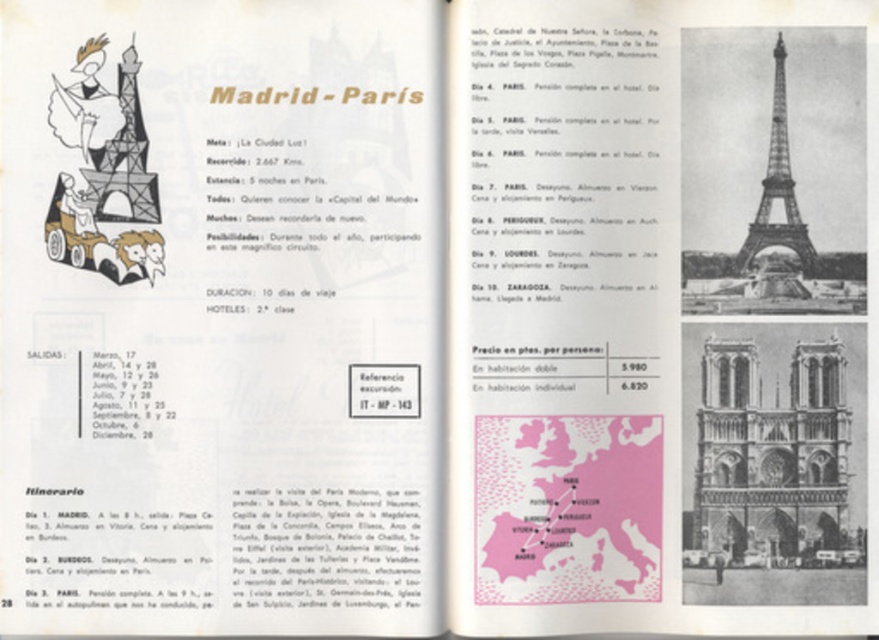
Question: Can you confirm if stone gothic cathedral at lower right is positioned to the left of metallic silver eiffel tower at upper right?

Choices:
 (A) no
 (B) yes

Answer: (B)

Question: Which point is farther from the camera taking this photo?

Choices:
 (A) (776, 76)
 (B) (746, 561)

Answer: (A)

Question: Does stone gothic cathedral at lower right appear on the left side of metallic silver eiffel tower at upper right?

Choices:
 (A) no
 (B) yes

Answer: (B)

Question: In this image, where is stone gothic cathedral at lower right located relative to metallic silver eiffel tower at upper right?

Choices:
 (A) left
 (B) right

Answer: (A)

Question: Which of the following is the farthest from the observer?

Choices:
 (A) (817, 428)
 (B) (782, 84)

Answer: (B)